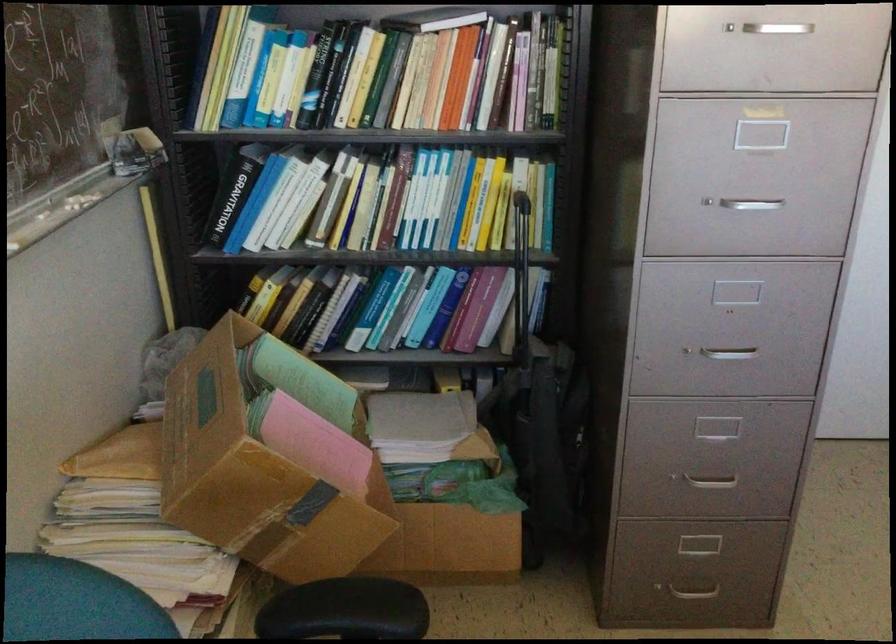
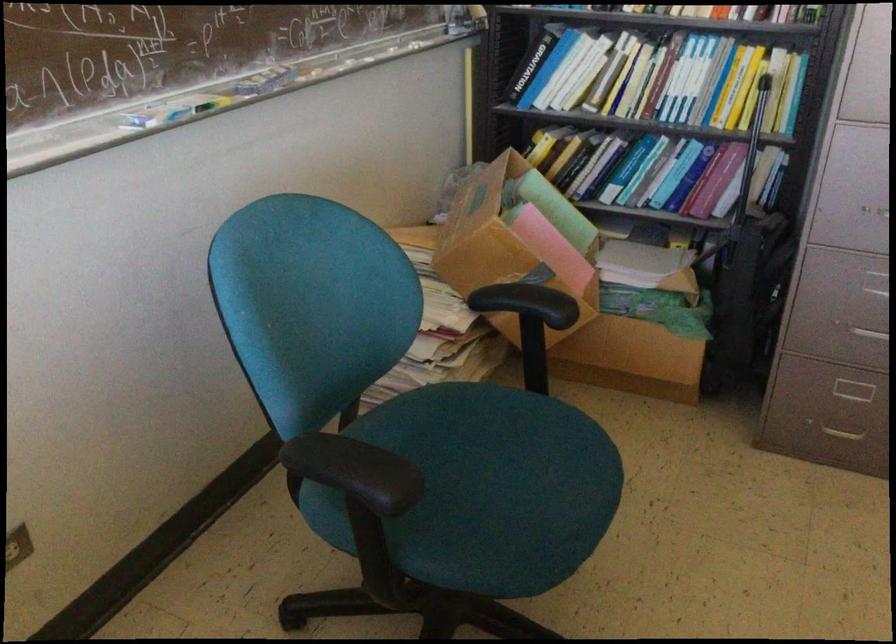
Locate, in the second image, the point that corresponds to pixel 493 204 in the first image.

(745, 86)